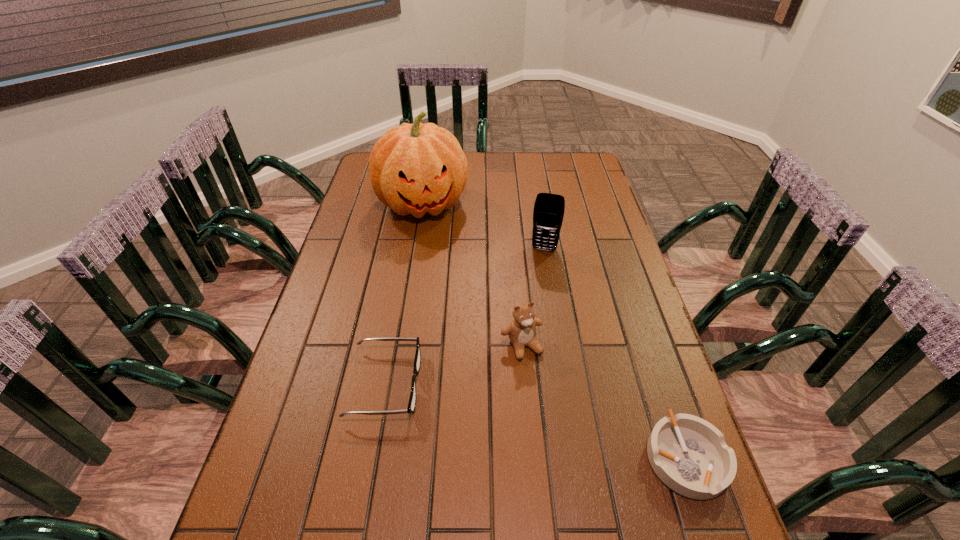
What are the coordinates of `spectacles` in the screenshot? It's located at (417, 361).

Where is `the shortest object`? the shortest object is located at coordinates (689, 455).

Where is `ashtray`? ashtray is located at coordinates (689, 455).

The height and width of the screenshot is (540, 960). I want to click on pumpkin, so click(416, 168).

In order to click on the tallest object in this screenshot , I will do `click(416, 168)`.

Locate an element on the screen. teddy bear is located at coordinates (521, 331).

Find the location of a particular element. The image size is (960, 540). the second farthest object is located at coordinates (548, 213).

The image size is (960, 540). I want to click on the second tallest object, so click(548, 213).

Identify the location of vacant region located on the front-facing side of the fourth tallest object. The image size is (960, 540). (507, 383).

This screenshot has height=540, width=960. I want to click on free space located on the left of the ashtray, so click(538, 457).